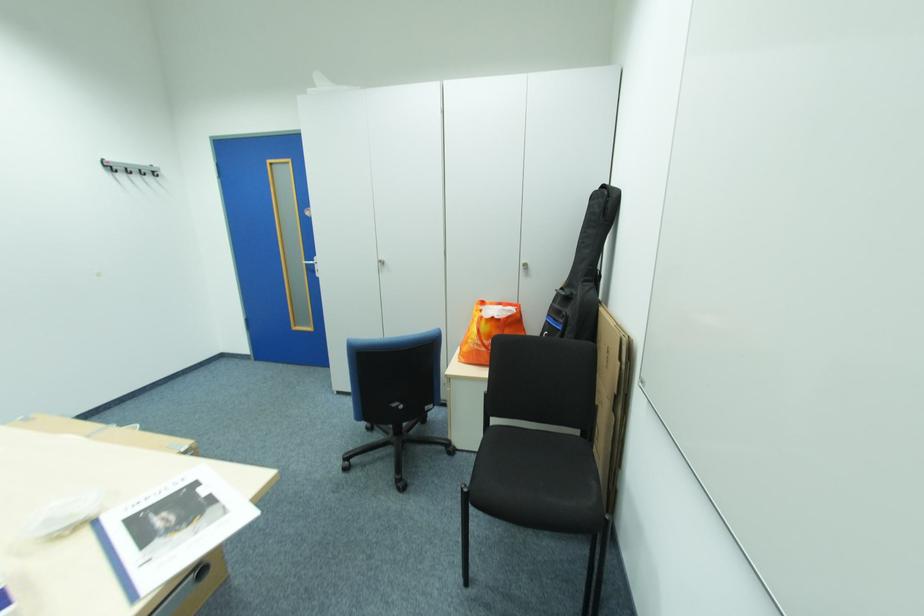
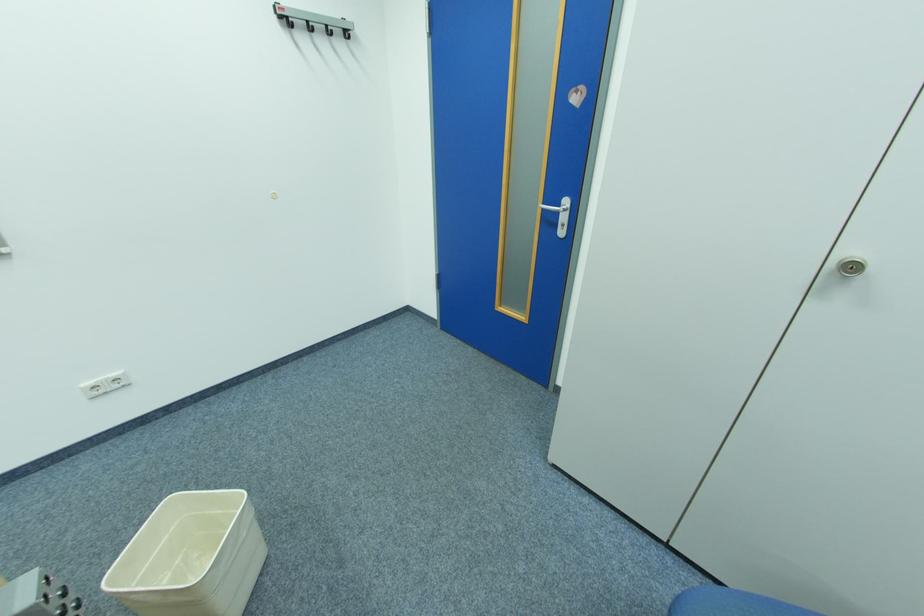
Where in the second image is the point corresponding to (114,171) from the first image?

(290, 25)